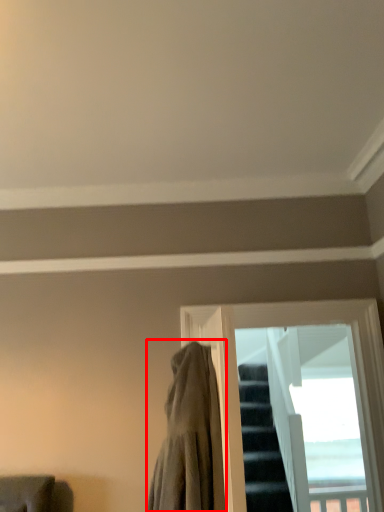
Question: From the image's perspective, where is cloak (annotated by the red box) located relative to window?

Choices:
 (A) above
 (B) below

Answer: (A)